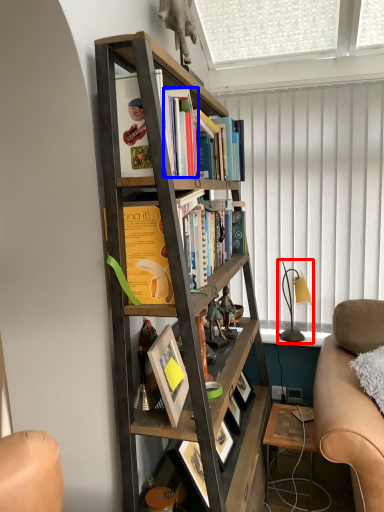
Question: Which of the following is the closest to the observer, table lamp (highlighted by a red box) or book (highlighted by a blue box)?

Choices:
 (A) table lamp
 (B) book

Answer: (B)